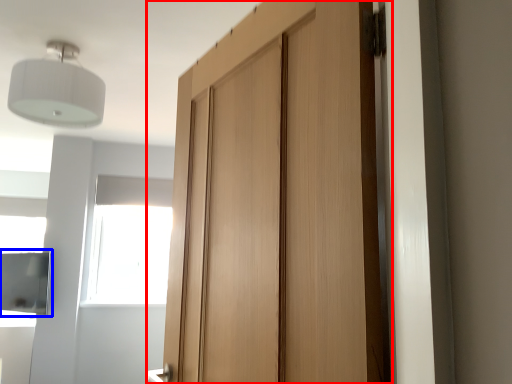
Question: Among these objects, which one is nearest to the camera, door (highlighted by a red box) or cabinetry (highlighted by a blue box)?

Choices:
 (A) door
 (B) cabinetry

Answer: (A)